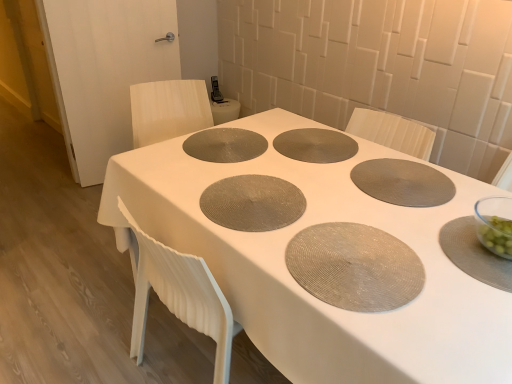
Describe the element at coordinates (403, 182) in the screenshot. I see `matte gray placemat at center right, marked as the first pizza pan in a right-to-left arrangement` at that location.

Where is `matte gray placemat at center, acting as the first pizza pan starting from the left`? This screenshot has height=384, width=512. matte gray placemat at center, acting as the first pizza pan starting from the left is located at coordinates (252, 203).

Locate an element on the screen. This screenshot has height=384, width=512. oval located above the matte gray placemat at center, marked as the 1th oval in a back-to-front arrangement (from a real-world perspective) is located at coordinates (355, 267).

Visually, is matte gray placemat at center, which appears as the first oval when viewed from the right, positioned to the left or to the right of matte gray placemat at center, marked as the 1th oval in a back-to-front arrangement?

Clearly, matte gray placemat at center, which appears as the first oval when viewed from the right, is on the right of matte gray placemat at center, marked as the 1th oval in a back-to-front arrangement, in the image.

Is matte gray placemat at center, placed as the 2th oval when sorted from back to front, not near matte gray placemat at center, marked as the 1th oval in a back-to-front arrangement?

matte gray placemat at center, placed as the 2th oval when sorted from back to front, is near matte gray placemat at center, marked as the 1th oval in a back-to-front arrangement, not far away.

In the image, is matte gray placemat at center, placed as the 2th oval when sorted from back to front, positioned in front of or behind matte gray placemat at center, the 1th oval from the top?

matte gray placemat at center, placed as the 2th oval when sorted from back to front, is positioned closer to the viewer than matte gray placemat at center, the 1th oval from the top.

Considering the relative sizes of matte gray placemat at center, the 2th pizza pan when ordered from left to right, and matte gray placemat at center right, which ranks as the third pizza pan in left-to-right order, in the image provided, is matte gray placemat at center, the 2th pizza pan when ordered from left to right, shorter than matte gray placemat at center right, which ranks as the third pizza pan in left-to-right order,?

Incorrect, the height of matte gray placemat at center, the 2th pizza pan when ordered from left to right, does not fall short of that of matte gray placemat at center right, which ranks as the third pizza pan in left-to-right order.

Based on their sizes in the image, would you say matte gray placemat at center, positioned as the second pizza pan in right-to-left order, is bigger or smaller than matte gray placemat at center right, marked as the first pizza pan in a right-to-left arrangement?

In the image, matte gray placemat at center, positioned as the second pizza pan in right-to-left order, appears to be larger than matte gray placemat at center right, marked as the first pizza pan in a right-to-left arrangement.

Consider the image. Is matte gray placemat at center, the 2th pizza pan when ordered from left to right, facing away from matte gray placemat at center right, which ranks as the third pizza pan in left-to-right order?

No, matte gray placemat at center right, which ranks as the third pizza pan in left-to-right order, is not at the back of matte gray placemat at center, the 2th pizza pan when ordered from left to right.

Consider the image. How different are the orientations of matte gray placemat at center, the 2th pizza pan when ordered from left to right, and matte gray placemat at center right, which ranks as the third pizza pan in left-to-right order, in degrees?

2.33 degrees.

Is matte gray placemat at center right, marked as the first pizza pan in a right-to-left arrangement, inside the boundaries of matte gray placemat at center, or outside?

matte gray placemat at center right, marked as the first pizza pan in a right-to-left arrangement, is located inside matte gray placemat at center.

Considering the points (366, 192) and (317, 315), which point is in front, point (366, 192) or point (317, 315)?

The point (317, 315) is closer to the camera.

Which is more to the left, matte gray placemat at center right, marked as the first pizza pan in a right-to-left arrangement, or matte gray placemat at center?

matte gray placemat at center.

Between matte gray placemat at center right, marked as the first pizza pan in a right-to-left arrangement, and matte gray placemat at center, which one has larger size?

matte gray placemat at center is bigger.

Is point (199, 150) positioned after point (398, 199)?

That is True.

How far apart are matte gray placemat at center, marked as the 1th oval in a back-to-front arrangement, and matte gray placemat at center right, marked as the first pizza pan in a right-to-left arrangement?

A distance of 20.75 inches exists between matte gray placemat at center, marked as the 1th oval in a back-to-front arrangement, and matte gray placemat at center right, marked as the first pizza pan in a right-to-left arrangement.

From a real-world perspective, does matte gray placemat at center, the 1th oval from the top, sit lower than matte gray placemat at center right, marked as the first pizza pan in a right-to-left arrangement?

Yes, from a real-world perspective, matte gray placemat at center, the 1th oval from the top, is below matte gray placemat at center right, marked as the first pizza pan in a right-to-left arrangement.

From the image's perspective, does matte gray placemat at center, acting as the first oval starting from the left, appear higher than matte gray placemat at center right, which ranks as the third pizza pan in left-to-right order?

Yes, from the image's perspective, matte gray placemat at center, acting as the first oval starting from the left, is over matte gray placemat at center right, which ranks as the third pizza pan in left-to-right order.

From a real-world perspective, who is located higher, matte gray placemat at center right, which ranks as the third pizza pan in left-to-right order, or matte gray placemat at center, marked as the 1th oval in a back-to-front arrangement?

matte gray placemat at center right, which ranks as the third pizza pan in left-to-right order, is physically above.

Considering the sizes of objects matte gray placemat at center right, marked as the first pizza pan in a right-to-left arrangement, and matte gray placemat at center, which is counted as the second oval, starting from the right, in the image provided, who is taller, matte gray placemat at center right, marked as the first pizza pan in a right-to-left arrangement, or matte gray placemat at center, which is counted as the second oval, starting from the right,?

matte gray placemat at center, which is counted as the second oval, starting from the right.

Is point (393, 181) farther from viewer compared to point (220, 132)?

No, it is not.

Which object is wider, matte gray placemat at center right, which ranks as the third pizza pan in left-to-right order, or matte gray placemat at center, which is counted as the second oval, starting from the right?

With larger width is matte gray placemat at center right, which ranks as the third pizza pan in left-to-right order.

From their relative heights in the image, would you say matte gray placemat at center, acting as the first pizza pan starting from the left, is taller or shorter than matte gray placemat at center right, which ranks as the third pizza pan in left-to-right order?

Considering their sizes, matte gray placemat at center, acting as the first pizza pan starting from the left, has more height than matte gray placemat at center right, which ranks as the third pizza pan in left-to-right order.

Can you confirm if matte gray placemat at center, positioned as the 3th pizza pan in right-to-left order, is smaller than matte gray placemat at center right, marked as the first pizza pan in a right-to-left arrangement?

Actually, matte gray placemat at center, positioned as the 3th pizza pan in right-to-left order, might be larger than matte gray placemat at center right, marked as the first pizza pan in a right-to-left arrangement.

Is matte gray placemat at center, acting as the first pizza pan starting from the left, to the left or to the right of matte gray placemat at center right, which ranks as the third pizza pan in left-to-right order, in the image?

Based on their positions, matte gray placemat at center, acting as the first pizza pan starting from the left, is located to the left of matte gray placemat at center right, which ranks as the third pizza pan in left-to-right order.

Can you tell me how much matte gray placemat at center, positioned as the 3th pizza pan in right-to-left order, and matte gray placemat at center right, marked as the first pizza pan in a right-to-left arrangement, differ in facing direction?

The angle between the facing direction of matte gray placemat at center, positioned as the 3th pizza pan in right-to-left order, and the facing direction of matte gray placemat at center right, marked as the first pizza pan in a right-to-left arrangement, is 179 degrees.

Does matte gray placemat at center, positioned as the 3th pizza pan in right-to-left order, lie in front of matte gray placemat at center, which is counted as the second oval, starting from the right?

That is True.

Does matte gray placemat at center, positioned as the 3th pizza pan in right-to-left order, contain matte gray placemat at center, acting as the first oval starting from the left?

No, matte gray placemat at center, positioned as the 3th pizza pan in right-to-left order, does not contain matte gray placemat at center, acting as the first oval starting from the left.

From the image's perspective, between matte gray placemat at center, positioned as the 3th pizza pan in right-to-left order, and matte gray placemat at center, the second oval in the bottom-to-top sequence, which one is located above?

matte gray placemat at center, the second oval in the bottom-to-top sequence.

Between point (202, 208) and point (267, 147), which one is positioned in front?

Point (202, 208)

I want to click on oval positioned vertically above the matte gray placemat at center, arranged as the 2th oval when viewed from the front (from a real-world perspective), so click(355, 267).

Locate an element on the screen. The height and width of the screenshot is (384, 512). pizza pan that is under the matte gray placemat at center right, which ranks as the third pizza pan in left-to-right order (from a real-world perspective) is located at coordinates (315, 145).

Which object lies further to the anchor point matte gray placemat at center, acting as the first pizza pan starting from the left, matte gray placemat at center or matte gray placemat at center right, marked as the first pizza pan in a right-to-left arrangement?

The object further to matte gray placemat at center, acting as the first pizza pan starting from the left, is matte gray placemat at center right, marked as the first pizza pan in a right-to-left arrangement.

When comparing their distances from matte gray placemat at center, arranged as the first oval when ordered from the bottom, does matte gray placemat at center right, marked as the first pizza pan in a right-to-left arrangement, or matte gray placemat at center, positioned as the 3th pizza pan in right-to-left order, seem further?

matte gray placemat at center right, marked as the first pizza pan in a right-to-left arrangement, is positioned further to the anchor matte gray placemat at center, arranged as the first oval when ordered from the bottom.

From the image, which object appears to be farther from matte gray placemat at center, positioned as the second pizza pan in right-to-left order, matte gray placemat at center, positioned as the 3th pizza pan in right-to-left order, or matte gray placemat at center right, which ranks as the third pizza pan in left-to-right order?

matte gray placemat at center, positioned as the 3th pizza pan in right-to-left order, is positioned further to the anchor matte gray placemat at center, positioned as the second pizza pan in right-to-left order.

When comparing their distances from matte gray placemat at center, does matte gray placemat at center, placed as the 2th oval when sorted from back to front, or matte gray placemat at center, positioned as the second pizza pan in right-to-left order, seem closer?

matte gray placemat at center, placed as the 2th oval when sorted from back to front.

Considering their positions, is matte gray placemat at center positioned closer to matte gray placemat at center, the 1th oval from the top, than matte gray placemat at center right, marked as the first pizza pan in a right-to-left arrangement?

Based on the image, matte gray placemat at center appears to be nearer to matte gray placemat at center, the 1th oval from the top.

Estimate the real-world distances between objects in this image. Which object is closer to matte gray placemat at center, acting as the first oval starting from the left, matte gray placemat at center, acting as the first pizza pan starting from the left, or matte gray placemat at center, the second oval in the top-to-bottom sequence?

matte gray placemat at center, acting as the first pizza pan starting from the left, lies closer to matte gray placemat at center, acting as the first oval starting from the left, than the other object.

Based on their spatial positions, is matte gray placemat at center or matte gray placemat at center, positioned as the second pizza pan in right-to-left order, closer to matte gray placemat at center, arranged as the first oval when ordered from the bottom?

Among the two, matte gray placemat at center is located nearer to matte gray placemat at center, arranged as the first oval when ordered from the bottom.

From the image, which object appears to be nearer to matte gray placemat at center, positioned as the 3th pizza pan in right-to-left order, matte gray placemat at center or matte gray placemat at center, positioned as the second pizza pan in right-to-left order?

Among the two, matte gray placemat at center is located nearer to matte gray placemat at center, positioned as the 3th pizza pan in right-to-left order.

Where is `oval between matte gray placemat at center and matte gray placemat at center, positioned as the 3th pizza pan in right-to-left order, from front to back`? Image resolution: width=512 pixels, height=384 pixels. oval between matte gray placemat at center and matte gray placemat at center, positioned as the 3th pizza pan in right-to-left order, from front to back is located at coordinates (355, 267).

What are the coordinates of `oval positioned between matte gray placemat at center and matte gray placemat at center, the second oval in the bottom-to-top sequence, from near to far` in the screenshot? It's located at (355, 267).

Locate an element on the screen. The width and height of the screenshot is (512, 384). oval between matte gray placemat at center and matte gray placemat at center right, marked as the first pizza pan in a right-to-left arrangement, along the z-axis is located at coordinates (355, 267).

Where is `pizza pan situated between matte gray placemat at center, positioned as the 3th pizza pan in right-to-left order, and matte gray placemat at center right, marked as the first pizza pan in a right-to-left arrangement, from left to right`? pizza pan situated between matte gray placemat at center, positioned as the 3th pizza pan in right-to-left order, and matte gray placemat at center right, marked as the first pizza pan in a right-to-left arrangement, from left to right is located at coordinates (315, 145).